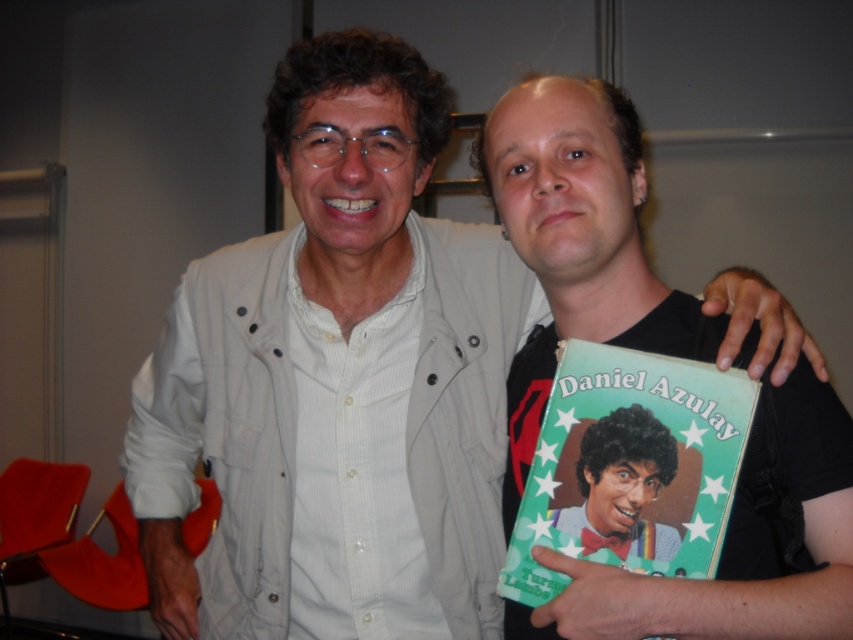
You are a photographer trying to capture a clear shot of both the black matte book at center and the green paper book at center. Since they are both at the center, which one is positioned higher in the frame?

The black matte book at center is located above the green paper book at center, so it is positioned higher in the frame.

You are a photographer trying to capture a clear shot of both the black matte book at center and the green paper book at center. Since both are at the center, which book will be more in focus if you focus on the one closer to the camera?

The black matte book at center will be more in focus because it is in front of the green paper book at center, making it closer to the camera.